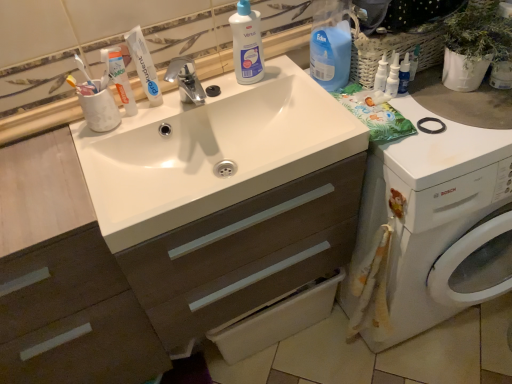
The width and height of the screenshot is (512, 384). Identify the location of spots to the right of white glossy bottle at upper center, arranged as the fourth cleaning product when viewed from the right. (295, 79).